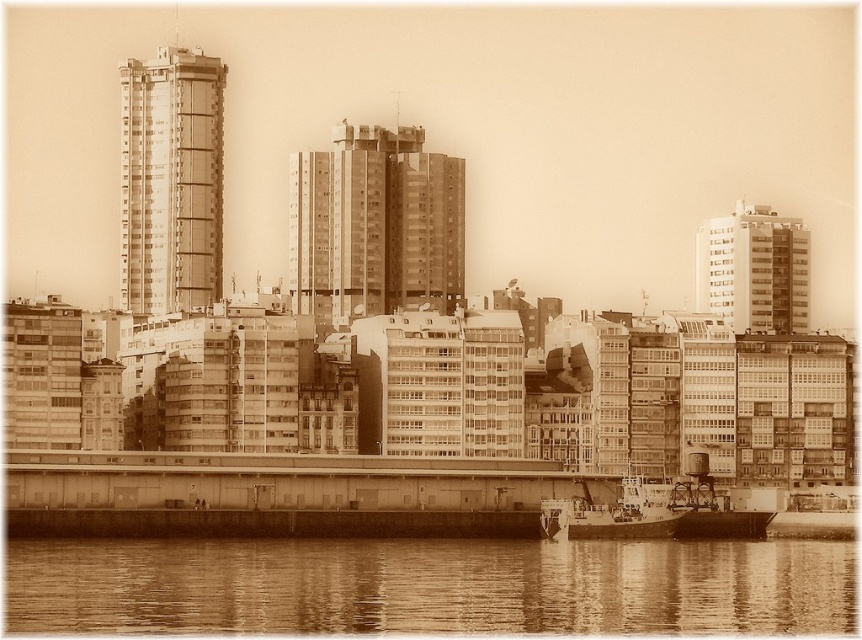
Question: Does smooth water at lower center appear under smooth concrete building at right?

Choices:
 (A) yes
 (B) no

Answer: (A)

Question: Which of the following is the farthest from the observer?

Choices:
 (A) metallic ship at lower center
 (B) smooth concrete building at center

Answer: (B)

Question: Can you confirm if smooth concrete building at center is smaller than smooth concrete building at right?

Choices:
 (A) no
 (B) yes

Answer: (A)

Question: Which point is farther from the camera taking this photo?

Choices:
 (A) (701, 516)
 (B) (172, 125)
 (C) (76, 547)

Answer: (B)

Question: Is smooth water at lower center to the left of smooth concrete building at right from the viewer's perspective?

Choices:
 (A) yes
 (B) no

Answer: (A)

Question: Which of the following is the farthest from the observer?

Choices:
 (A) metallic ship at lower center
 (B) smooth concrete building at right
 (C) smooth water at lower center

Answer: (B)